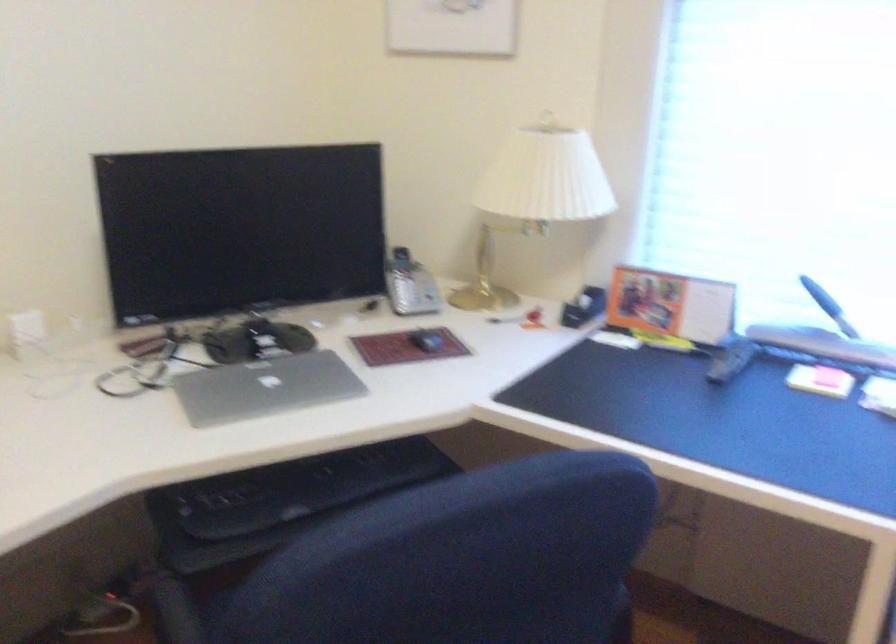
The image size is (896, 644). In order to click on silver phone handset in this screenshot , I will do `click(401, 281)`.